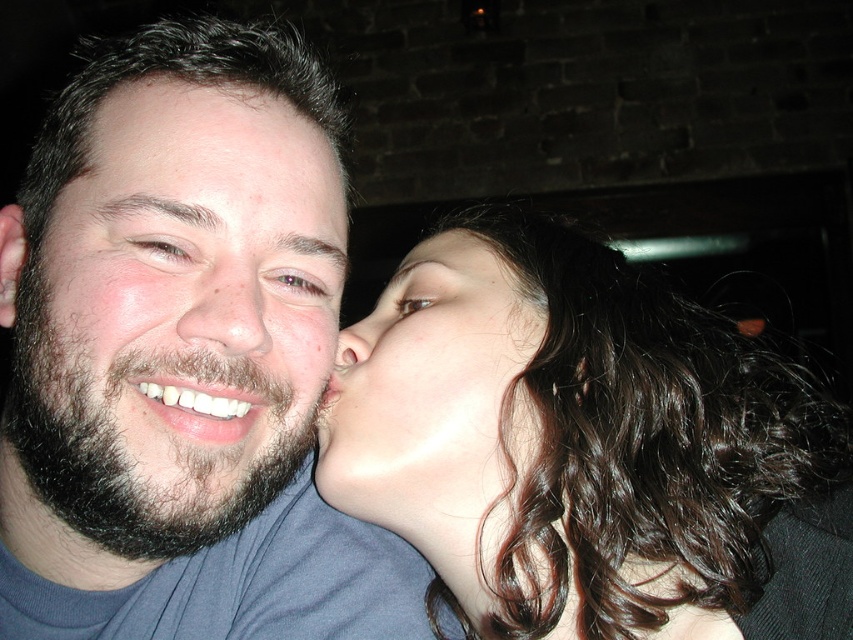
Is smooth skin face at center to the right of dark brown fuzzy beard at left from the viewer's perspective?

Yes, smooth skin face at center is to the right of dark brown fuzzy beard at left.

Does smooth skin face at center have a smaller size compared to dark brown fuzzy beard at left?

Yes, smooth skin face at center is smaller than dark brown fuzzy beard at left.

The image size is (853, 640). Describe the element at coordinates (434, 394) in the screenshot. I see `smooth skin face at center` at that location.

Find the location of a particular element. This screenshot has width=853, height=640. smooth skin face at center is located at coordinates (434, 394).

Is brown matte eye at upper center shorter than brown matte eye at center?

Correct, brown matte eye at upper center is not as tall as brown matte eye at center.

Between point (317, 291) and point (428, 300), which one is positioned in front?

Point (317, 291)

Is point (312, 291) closer to viewer compared to point (415, 298)?

Yes, it is in front of point (415, 298).

This screenshot has width=853, height=640. In order to click on brown matte eye at upper center in this screenshot , I will do `click(294, 282)`.

Is dark blue t-shirt at left closer to the viewer compared to dark brown hair at upper right?

That is True.

Where is `dark blue t-shirt at left`? dark blue t-shirt at left is located at coordinates (180, 360).

I want to click on dark blue t-shirt at left, so coord(180,360).